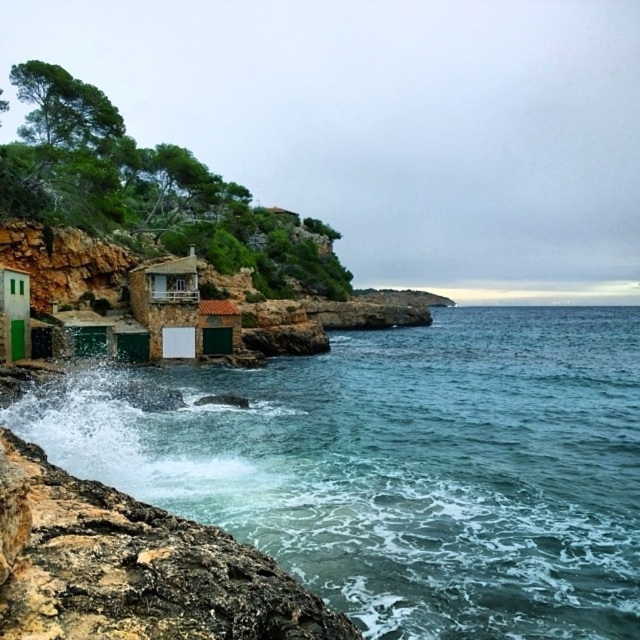
Question: Which object is the farthest from the blue-green liquid at lower center?

Choices:
 (A) green matte door at lower left
 (B) green matte hut at lower center

Answer: (A)

Question: Can you confirm if blue-green liquid at lower center is wider than green matte hut at lower center?

Choices:
 (A) yes
 (B) no

Answer: (A)

Question: Is blue-green liquid at lower center above green matte door at lower left?

Choices:
 (A) yes
 (B) no

Answer: (B)

Question: Does blue-green liquid at lower center have a smaller size compared to green matte hut at lower center?

Choices:
 (A) no
 (B) yes

Answer: (A)

Question: Which object is positioned closest to the green matte hut at lower center?

Choices:
 (A) blue-green liquid at lower center
 (B) green matte door at lower left

Answer: (A)

Question: Which object is farther from the camera taking this photo?

Choices:
 (A) blue-green liquid at lower center
 (B) green matte hut at lower center

Answer: (B)